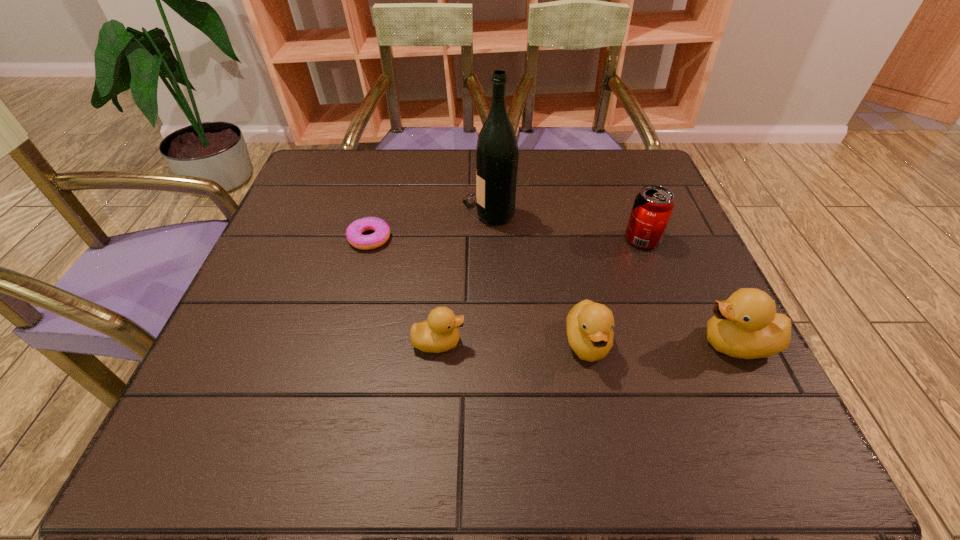
You are a GUI agent. You are given a task and a screenshot of the screen. Output one action in this format:
    pyautogui.click(x=<x>, y=<y>)
    Task: Click on the empty space that is in between the tallest duckling and the doughnut
    
    Given the screenshot: What is the action you would take?
    pyautogui.click(x=553, y=291)

Find the location of a particular element. The height and width of the screenshot is (540, 960). vacant space that is in between the rightmost duckling and the second shortest duckling is located at coordinates (661, 343).

You are a GUI agent. You are given a task and a screenshot of the screen. Output one action in this format:
    pyautogui.click(x=<x>, y=<y>)
    Task: Click on the free area in between the second duckling from right to left and the fifth tallest object
    The width and height of the screenshot is (960, 540).
    Given the screenshot: What is the action you would take?
    pyautogui.click(x=513, y=342)

Locate an element on the screen. The image size is (960, 540). vacant area that lies between the doughnut and the rightmost duckling is located at coordinates (553, 291).

Where is `vacant point located between the doughnut and the soda can`? This screenshot has width=960, height=540. vacant point located between the doughnut and the soda can is located at coordinates (506, 239).

Where is `vacant space in between the leftmost object and the wine bottle`? The width and height of the screenshot is (960, 540). vacant space in between the leftmost object and the wine bottle is located at coordinates (429, 225).

Locate an element on the screen. The height and width of the screenshot is (540, 960). object that stands as the fifth closest to the soda can is located at coordinates (354, 231).

Find the location of a particular element. Image resolution: width=960 pixels, height=540 pixels. object that is the closest one to the soda can is located at coordinates (746, 325).

Where is `the closest duckling to the second tallest duckling`? The width and height of the screenshot is (960, 540). the closest duckling to the second tallest duckling is located at coordinates (746, 325).

Identify which duckling is the closest to the shortest duckling. Please provide its 2D coordinates. Your answer should be formatted as a tuple, i.e. [(x, y)], where the tuple contains the x and y coordinates of a point satisfying the conditions above.

[(589, 325)]